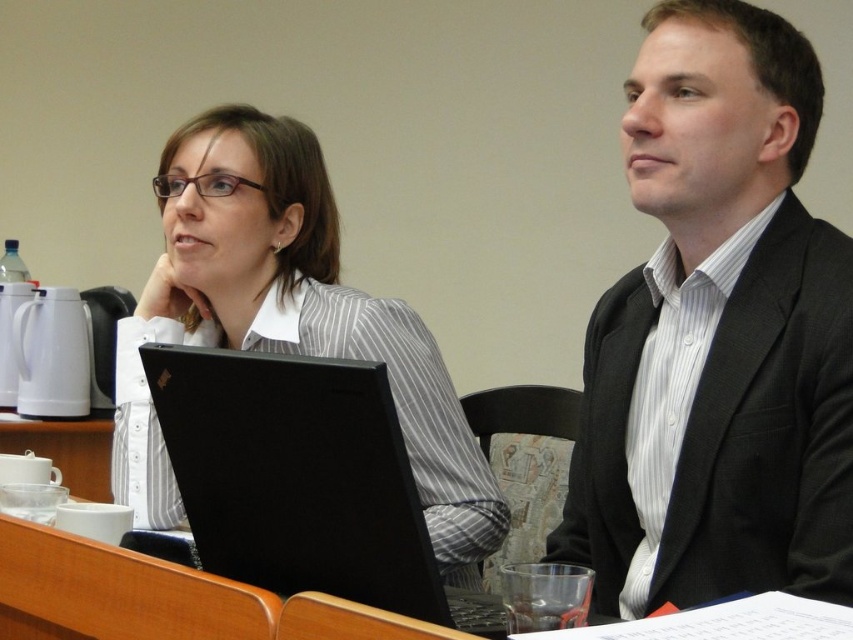
You are organizing a charity event and need to decide which of the two outfits, the black textured suit at center or the white striped shirt at center, would be more appropriate for a formal event. Based on their sizes, which one is more likely to be the formal attire?

The black textured suit at center has a smaller size compared to the white striped shirt at center, so the white striped shirt at center is more likely to be the formal attire as formal suits are typically larger in size to accommodate a professional silhouette.

You are a security guard in the building and need to ensure social distancing between people in the conference room. The minimum distance required is 1.5 meters. Are the two people in the white striped shirt at center and the other person following the social distancing rule?

The two people are 1.30 meters apart, which is less than the required 1.5 meters. Therefore, they are not following the social distancing rule.